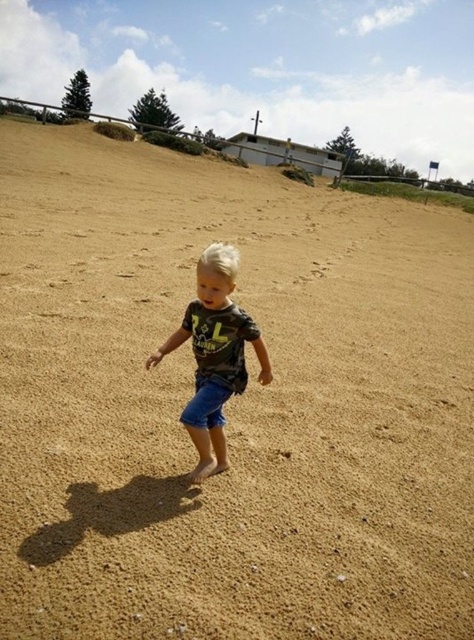
Which is more to the right, matte black t-shirt at center or blue denim shorts at center?

Positioned to the right is blue denim shorts at center.

Describe the element at coordinates (215, 355) in the screenshot. The image size is (474, 640). I see `matte black t-shirt at center` at that location.

Find the location of a particular element. matte black t-shirt at center is located at coordinates (215, 355).

Identify the location of matte black t-shirt at center. (215, 355).